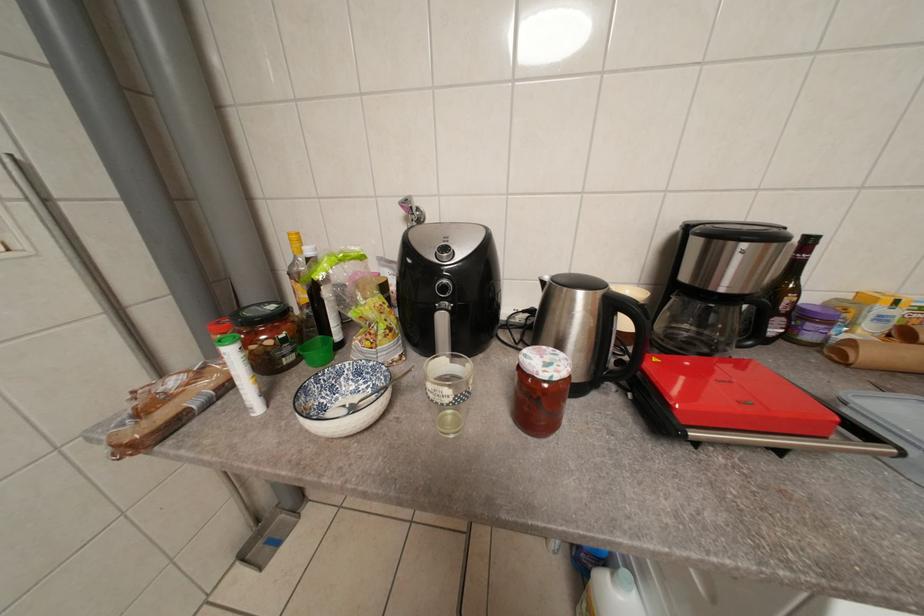
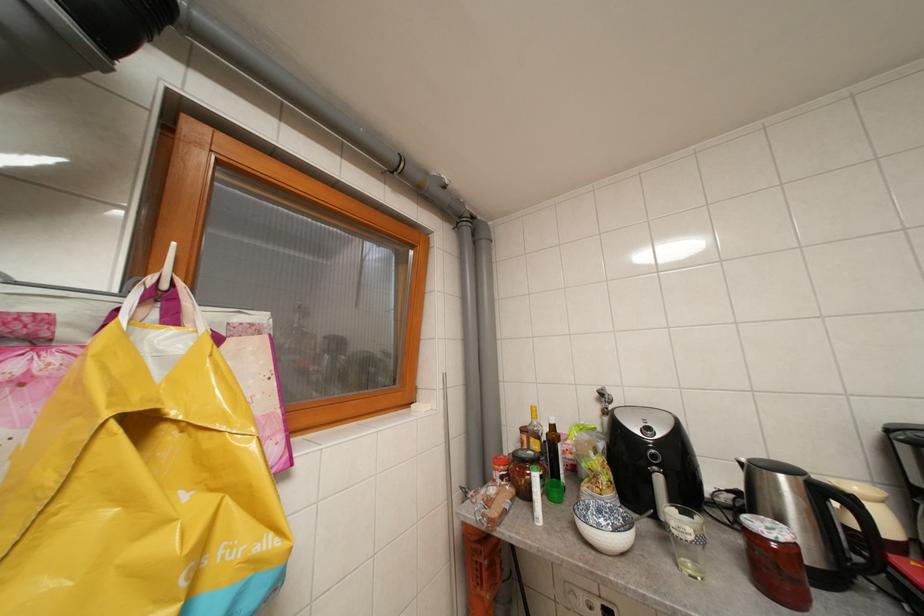
The first image is from the beginning of the video and the second image is from the end. How did the camera likely rotate when shooting the video?

The camera rotated toward left-up.